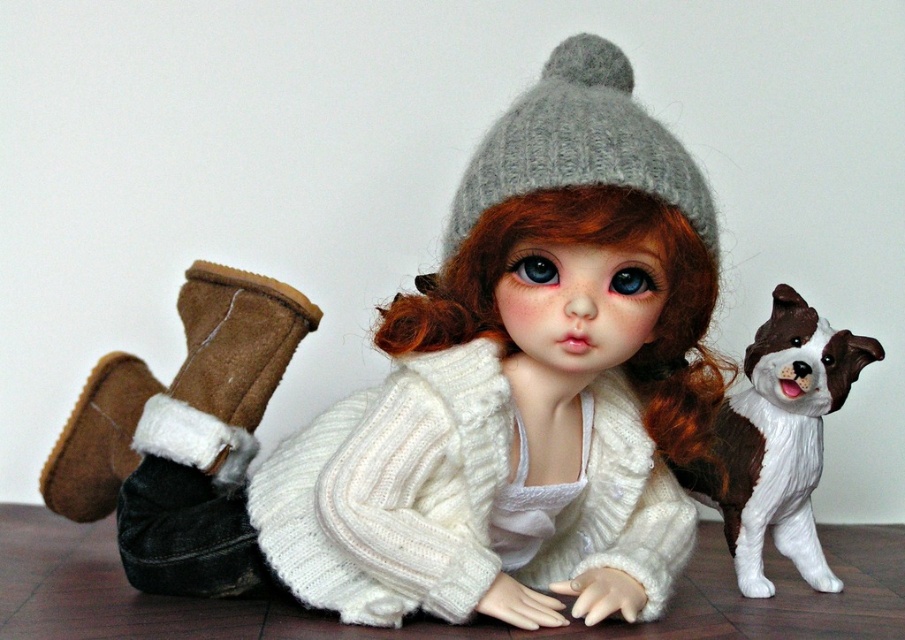
Who is lower down, brown and white plastic dog at right or brown suede boot at lower left?

brown and white plastic dog at right

Between brown and white plastic dog at right and brown suede boot at lower left, which one is positioned higher?

brown suede boot at lower left

Does point (782, 337) lie behind point (189, 342)?

Yes.

The image size is (905, 640). I want to click on brown and white plastic dog at right, so click(x=778, y=440).

Does white knitted sweater at center have a greater height compared to brown suede boot at lower left?

Yes, white knitted sweater at center is taller than brown suede boot at lower left.

Between point (484, 576) and point (189, 337), which one is positioned in front?

Point (484, 576)

Which is behind, point (286, 493) or point (195, 282)?

Positioned behind is point (195, 282).

At what (x,y) coordinates should I click in order to perform the action: click on white knitted sweater at center. Please return your answer as a coordinate pair (x, y). Looking at the image, I should click on (492, 397).

You are a GUI agent. You are given a task and a screenshot of the screen. Output one action in this format:
    pyautogui.click(x=<x>, y=<y>)
    Task: Click on the gray knitted hat at center
    The image size is (905, 640).
    Given the screenshot: What is the action you would take?
    pyautogui.click(x=579, y=144)

Is point (598, 131) positioned before point (63, 484)?

Yes, it is.

Between point (461, 200) and point (197, 323), which one is positioned behind?

The point (197, 323) is more distant.

Where is `gray knitted hat at center`? gray knitted hat at center is located at coordinates (579, 144).